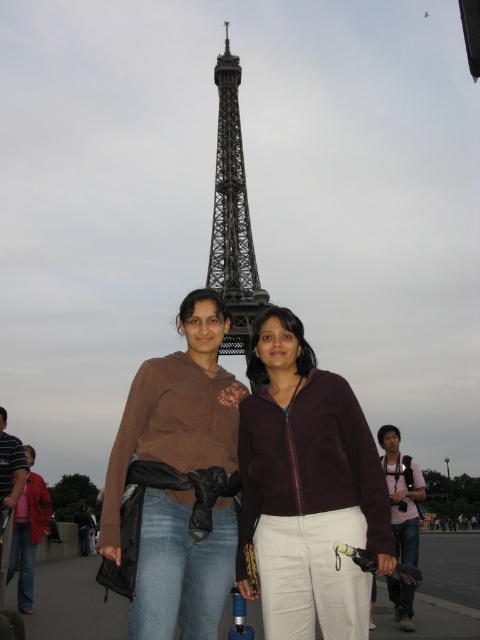
You are a photographer trying to capture the Eiffel Tower in the background while focusing on the two people in front. The purple fleece jacket at center is at point (x=307, y=488). Where should you position your camera to ensure the Eiffel Tower is visible behind the purple fleece jacket at center?

To capture the Eiffel Tower behind the purple fleece jacket at center, position your camera so that the purple fleece jacket at center is centered at point (x=307, y=488). Since the Eiffel Tower is in the background dominating the scene, aligning the camera to focus on the purple fleece jacket at center will naturally frame the Eiffel Tower in the backdrop.

You are a photographer trying to capture a photo of the black metal eiffel tower at center and the brushed metal jacket at lower left. Which object should you focus on first if you want to ensure both are in sharp focus?

The black metal eiffel tower at center is larger in size than the brushed metal jacket at lower left, so you should focus on the black metal eiffel tower at center first to ensure both are in sharp focus.

You are a photographer trying to capture a detailed closeup of the pink fabric bag at center and the brushed metal jacket at lower left. Since you want both items to be clearly visible in the photo, which object should you focus on to ensure it appears sharp, considering their sizes?

The pink fabric bag at center has a larger size compared to the brushed metal jacket at lower left. To ensure both are sharp, focus on the pink fabric bag at center since it requires more detailed focus due to its larger size.